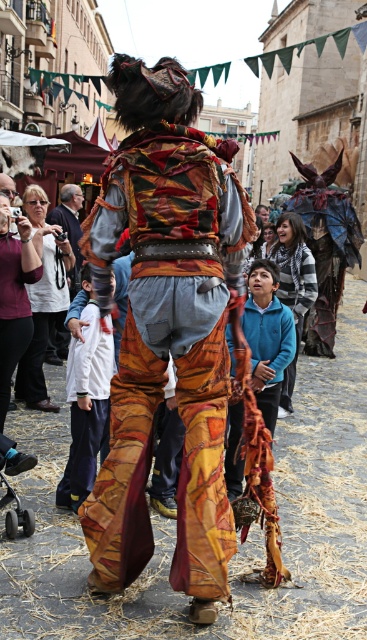
In the scene shown: Who is positioned more to the left, textured fabric costume at center or matte black camera at left?

Positioned to the left is matte black camera at left.

This screenshot has width=367, height=640. What are the coordinates of `textured fabric costume at center` in the screenshot? It's located at (168, 349).

Who is higher up, blue fleece sweater at center or matte black camera at left?

matte black camera at left is higher up.

Which is below, blue fleece sweater at center or matte black camera at left?

blue fleece sweater at center is below.

Where is `blue fleece sweater at center`? This screenshot has width=367, height=640. blue fleece sweater at center is located at coordinates (293, 296).

Is textured fabric costume at center below blue fleece sweater at center?

Yes.

Can you confirm if textured fabric costume at center is positioned to the left of blue fleece sweater at center?

Yes, textured fabric costume at center is to the left of blue fleece sweater at center.

Which is behind, point (150, 528) or point (282, 394)?

Positioned behind is point (282, 394).

This screenshot has width=367, height=640. I want to click on textured fabric costume at center, so click(x=168, y=349).